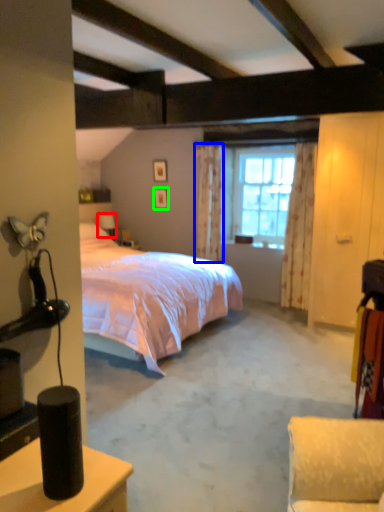
Question: Considering the real-world distances, which object is farthest from table lamp (highlighted by a red box)? curtain (highlighted by a blue box) or picture frame (highlighted by a green box)?

Choices:
 (A) curtain
 (B) picture frame

Answer: (A)